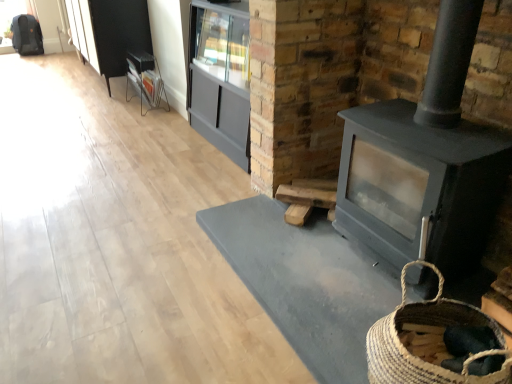
Question: Should I look upward or downward to see metallic silver magazine rack at upper left?

Choices:
 (A) down
 (B) up

Answer: (B)

Question: Does natural woven basket at lower right touch metallic silver magazine rack at upper left?

Choices:
 (A) yes
 (B) no

Answer: (B)

Question: From a real-world perspective, is natural woven basket at lower right located beneath metallic silver magazine rack at upper left?

Choices:
 (A) yes
 (B) no

Answer: (B)

Question: Is natural woven basket at lower right far from metallic silver magazine rack at upper left?

Choices:
 (A) no
 (B) yes

Answer: (B)

Question: Is natural woven basket at lower right to the left of metallic silver magazine rack at upper left from the viewer's perspective?

Choices:
 (A) no
 (B) yes

Answer: (A)

Question: Does natural woven basket at lower right have a lesser height compared to metallic silver magazine rack at upper left?

Choices:
 (A) no
 (B) yes

Answer: (B)

Question: Is natural woven basket at lower right oriented away from metallic silver magazine rack at upper left?

Choices:
 (A) no
 (B) yes

Answer: (A)

Question: Does natural woven basket at lower right lie behind matte gray wood burning stove at right?

Choices:
 (A) yes
 (B) no

Answer: (B)

Question: Is matte gray wood burning stove at right surrounded by natural woven basket at lower right?

Choices:
 (A) no
 (B) yes

Answer: (A)

Question: From a real-world perspective, is natural woven basket at lower right located beneath matte gray wood burning stove at right?

Choices:
 (A) no
 (B) yes

Answer: (B)

Question: Is natural woven basket at lower right outside matte gray wood burning stove at right?

Choices:
 (A) no
 (B) yes

Answer: (B)

Question: Does natural woven basket at lower right have a smaller size compared to matte gray wood burning stove at right?

Choices:
 (A) no
 (B) yes

Answer: (B)

Question: Considering the relative sizes of natural woven basket at lower right and matte gray wood burning stove at right in the image provided, is natural woven basket at lower right bigger than matte gray wood burning stove at right?

Choices:
 (A) yes
 (B) no

Answer: (B)

Question: Considering the relative sizes of matte gray cabinet at center and metallic silver magazine rack at upper left in the image provided, is matte gray cabinet at center thinner than metallic silver magazine rack at upper left?

Choices:
 (A) no
 (B) yes

Answer: (A)